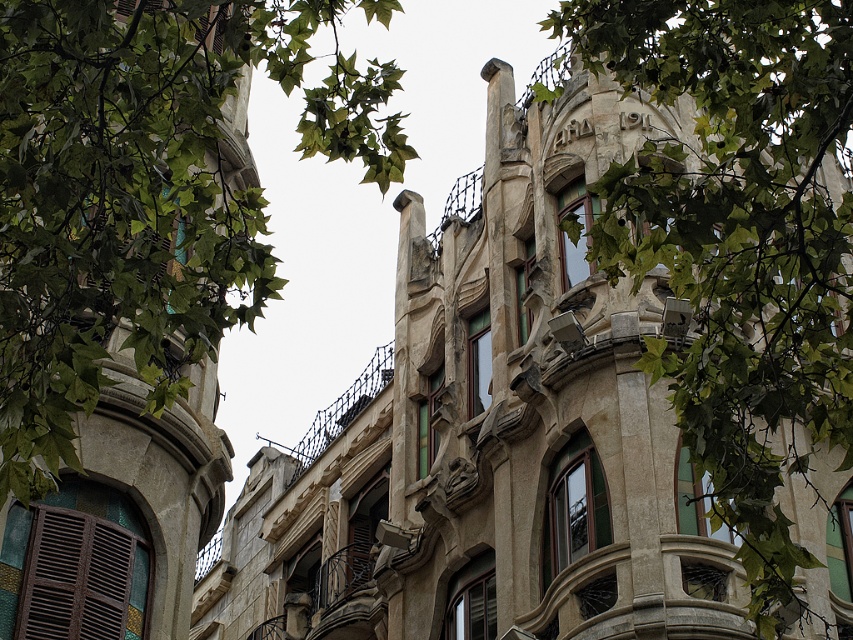
Question: Which point is closer to the camera taking this photo?

Choices:
 (A) (51, 65)
 (B) (838, 164)

Answer: (A)

Question: Which point is closer to the camera taking this photo?

Choices:
 (A) (184, 225)
 (B) (785, 330)

Answer: (B)

Question: In this image, where is green leafy branches at upper left located relative to green leafy branches at upper center?

Choices:
 (A) right
 (B) left

Answer: (B)

Question: Is green leafy branches at upper left above green leafy branches at upper center?

Choices:
 (A) yes
 (B) no

Answer: (A)

Question: Among these objects, which one is farthest from the camera?

Choices:
 (A) green leafy branches at upper left
 (B) green leafy branches at upper center

Answer: (B)

Question: Does green leafy branches at upper left appear on the left side of green leafy branches at upper center?

Choices:
 (A) yes
 (B) no

Answer: (A)